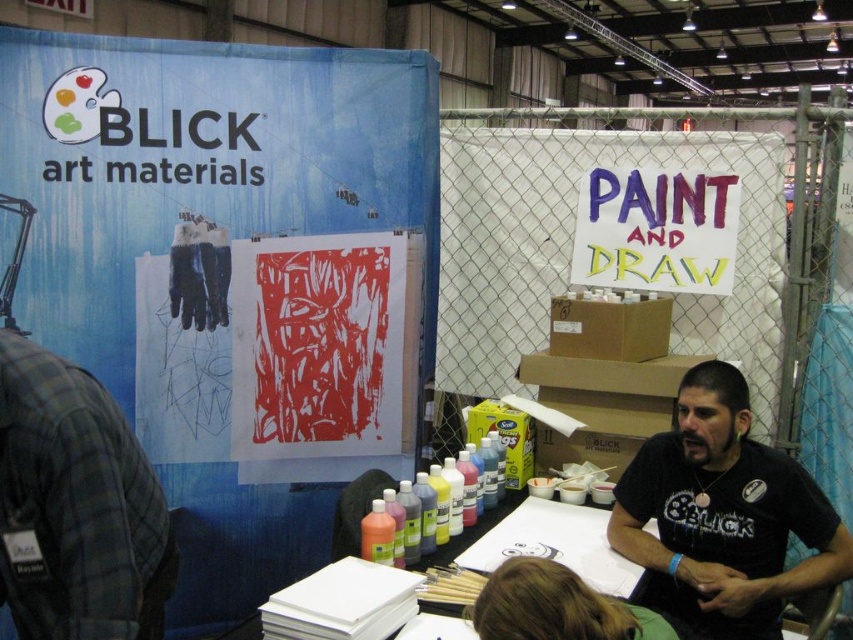
Question: Is matte paper poster at upper left positioned before red linoleum print at center?

Choices:
 (A) yes
 (B) no

Answer: (A)

Question: Which of these objects is positioned closest to the matte plastic bottles at center?

Choices:
 (A) red linoleum print at center
 (B) plaid flannel shirt at left
 (C) dark brown hair at lower center

Answer: (A)

Question: Which object appears closest to the camera in this image?

Choices:
 (A) matte paper poster at upper left
 (B) plaid flannel shirt at left

Answer: (B)

Question: Observing the image, what is the correct spatial positioning of matte paper poster at upper left in reference to plaid flannel shirt at left?

Choices:
 (A) above
 (B) below

Answer: (A)

Question: From the image, what is the correct spatial relationship of red linoleum print at center in relation to matte paint sign at center?

Choices:
 (A) above
 (B) below

Answer: (B)

Question: Based on their relative distances, which object is farther from the black matte shirt at lower right?

Choices:
 (A) matte paint sign at center
 (B) plaid flannel shirt at left
 (C) dark brown hair at lower center
 (D) red linoleum print at center

Answer: (B)